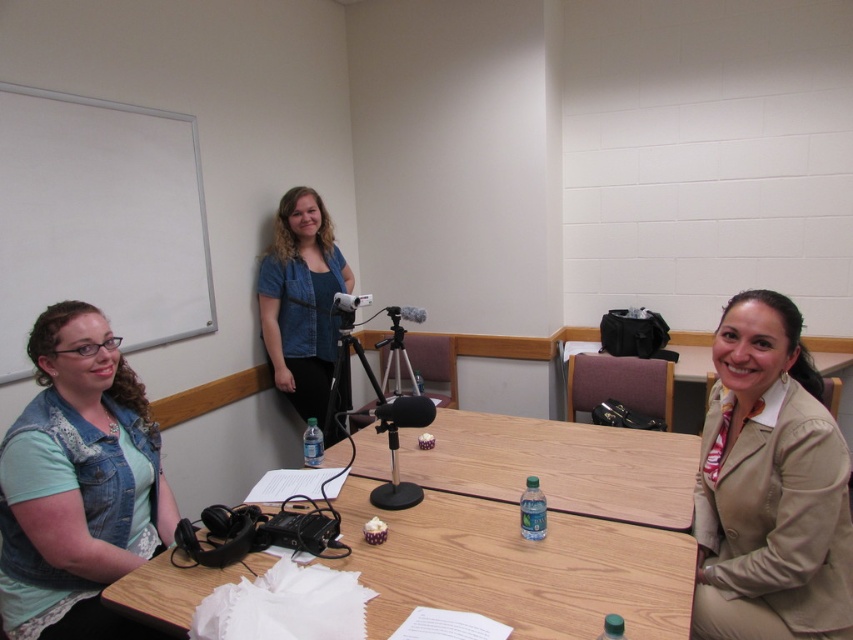
Question: Which point appears closest to the camera in this image?

Choices:
 (A) (335, 410)
 (B) (596, 442)

Answer: (B)

Question: Which of the following is the closest to the observer?

Choices:
 (A) wooden table at center
 (B) black matte tripod at center
 (C) denim vest at lower left

Answer: (C)

Question: Which point is farther from the camera taking this photo?

Choices:
 (A) (347, 333)
 (B) (57, 636)
 (C) (846, 612)

Answer: (A)

Question: Can you confirm if white matte whiteboard at upper left is bigger than black matte tripod at center?

Choices:
 (A) yes
 (B) no

Answer: (A)

Question: Does denim jacket at upper center appear over wooden table at lower right?

Choices:
 (A) no
 (B) yes

Answer: (B)

Question: Does wooden table at lower center have a greater width compared to wooden table at center?

Choices:
 (A) yes
 (B) no

Answer: (A)